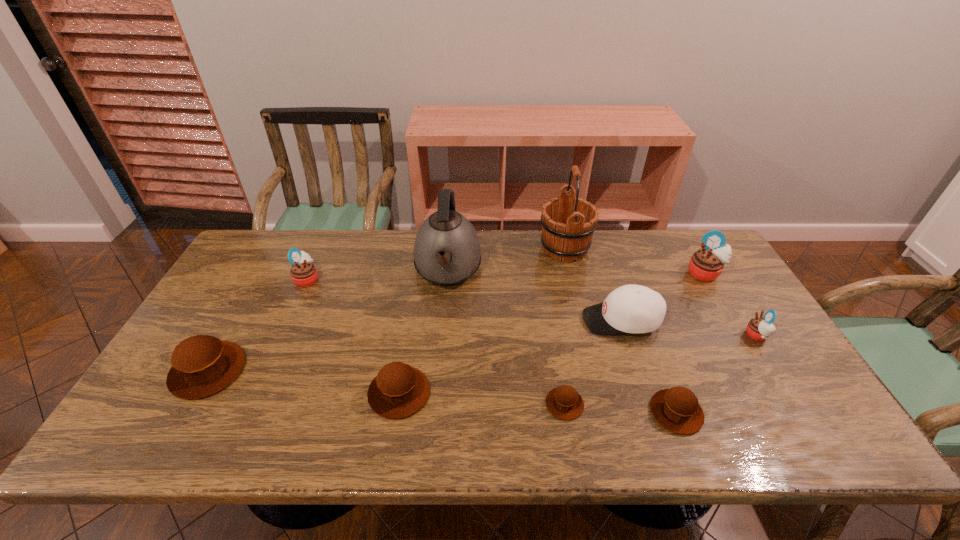
The height and width of the screenshot is (540, 960). Find the location of `wine bucket`. wine bucket is located at coordinates (568, 223).

Identify the location of gray kettle. This screenshot has width=960, height=540. (447, 251).

Where is `the tallest muffin`? The height and width of the screenshot is (540, 960). the tallest muffin is located at coordinates (706, 264).

Find the location of a particular element. The width and height of the screenshot is (960, 540). the biggest pink muffin is located at coordinates (706, 264).

Where is `the second smallest pink muffin`? the second smallest pink muffin is located at coordinates (303, 272).

Identify the location of the sixth muffin from right to left. The image size is (960, 540). (303, 272).

You are a GUI agent. You are given a task and a screenshot of the screen. Output one action in this format:
    pyautogui.click(x=<x>, y=<y>)
    Task: Click on the baseball cap
    
    Given the screenshot: What is the action you would take?
    pyautogui.click(x=631, y=308)

Find the location of a particular element. the leftmost object is located at coordinates (x=202, y=365).

You are a GUI agent. You are given a task and a screenshot of the screen. Output one action in this format:
    pyautogui.click(x=<x>, y=<y>)
    Task: Click on the leftmost muffin
    Image resolution: width=960 pixels, height=540 pixels.
    Given the screenshot: What is the action you would take?
    pyautogui.click(x=202, y=365)

Find the location of a particular element. The width and height of the screenshot is (960, 540). the nearest pink muffin is located at coordinates (759, 329).